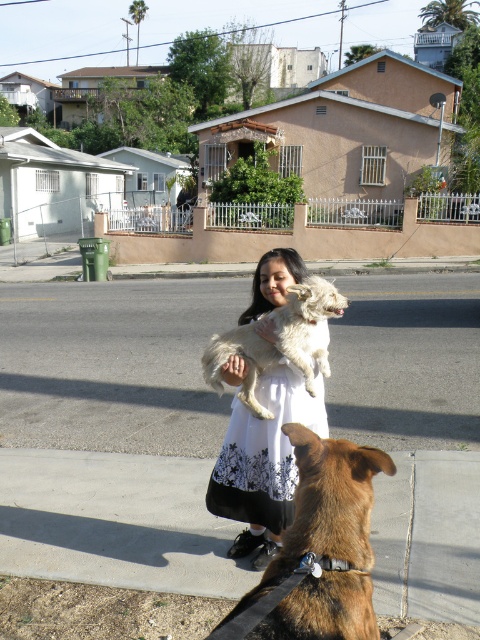
You are a GUI agent. You are given a task and a screenshot of the screen. Output one action in this format:
    pyautogui.click(x=<x>, y=<y>)
    Task: Click on the brown furry dog at lower center
    Image resolution: width=480 pixels, height=640 pixels.
    Given the screenshot: What is the action you would take?
    pyautogui.click(x=319, y=550)

Is brown furry dog at lower center wider than white fluffy dog at center?

No.

Which is behind, point (313, 637) or point (328, 296)?

Point (328, 296)

In order to click on brown furry dog at lower center in this screenshot , I will do `click(319, 550)`.

What do you see at coordinates (263, 461) in the screenshot?
I see `white lace dress at center` at bounding box center [263, 461].

Between point (257, 452) and point (312, 321), which one is positioned behind?

The point (257, 452) is more distant.

Describe the element at coordinates (263, 461) in the screenshot. I see `white lace dress at center` at that location.

The height and width of the screenshot is (640, 480). I want to click on white lace dress at center, so click(x=263, y=461).

Based on the photo, is brown furry dog at lower center thinner than white lace dress at center?

Indeed, brown furry dog at lower center has a lesser width compared to white lace dress at center.

From the picture: Between brown furry dog at lower center and white lace dress at center, which one is positioned lower?

brown furry dog at lower center is lower down.

Is point (338, 508) farther from camera compared to point (223, 445)?

No, it is in front of (223, 445).

Where is `brown furry dog at lower center`? brown furry dog at lower center is located at coordinates (319, 550).